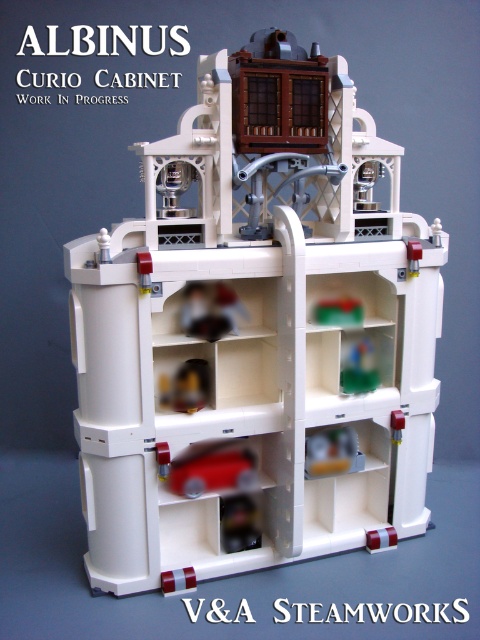
Question: Is matte white car at center further to camera compared to green plastic toy at center?

Choices:
 (A) no
 (B) yes

Answer: (A)

Question: Observing the image, what is the correct spatial positioning of matte plastic toy car at lower center in reference to green plastic toy at center?

Choices:
 (A) above
 (B) below

Answer: (B)

Question: Which object is positioned closest to the green plastic toy at center?

Choices:
 (A) matte red car at center
 (B) translucent green glass at center
 (C) matte white car at center
 (D) matte plastic toy car at lower center

Answer: (B)

Question: Does matte plastic toy car at lower center appear on the right side of translucent green glass at center?

Choices:
 (A) yes
 (B) no

Answer: (B)

Question: Based on their relative distances, which object is nearer to the matte white car at center?

Choices:
 (A) matte red car at center
 (B) white plastic car at center

Answer: (B)

Question: Based on their relative distances, which object is nearer to the green plastic toy at center?

Choices:
 (A) white plastic car at center
 (B) matte plastic toy car at lower center
 (C) matte red car at center
 (D) matte white car at center

Answer: (D)